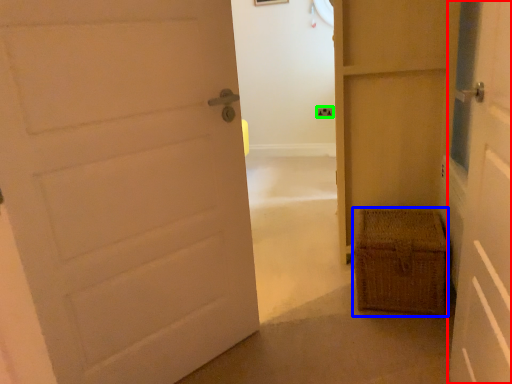
Question: Which object is the farthest from door (highlighted by a red box)? Choose among these: crate (highlighted by a blue box) or electric outlet (highlighted by a green box).

Choices:
 (A) crate
 (B) electric outlet

Answer: (B)